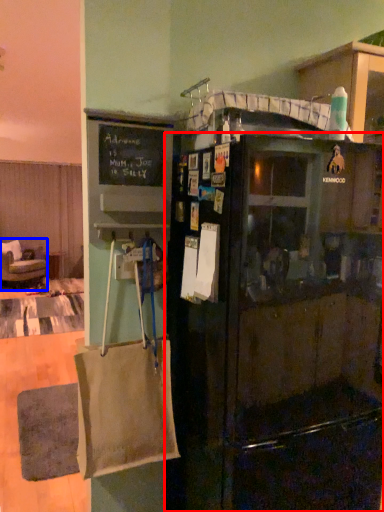
Question: Among these objects, which one is farthest to the camera, refrigerator (highlighted by a red box) or chair (highlighted by a blue box)?

Choices:
 (A) refrigerator
 (B) chair

Answer: (B)